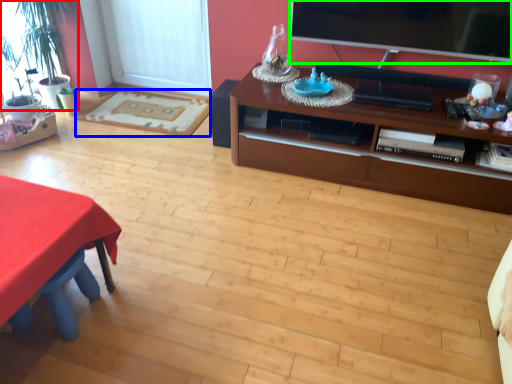
Question: Which object is the farthest from houseplant (highlighted by a red box)? Choose among these: flat (highlighted by a blue box) or television (highlighted by a green box).

Choices:
 (A) flat
 (B) television

Answer: (B)